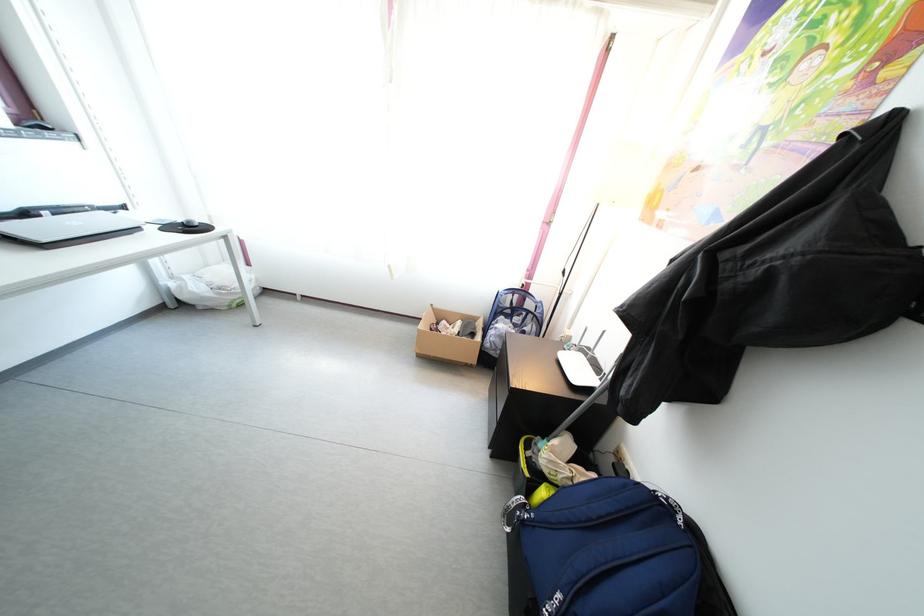
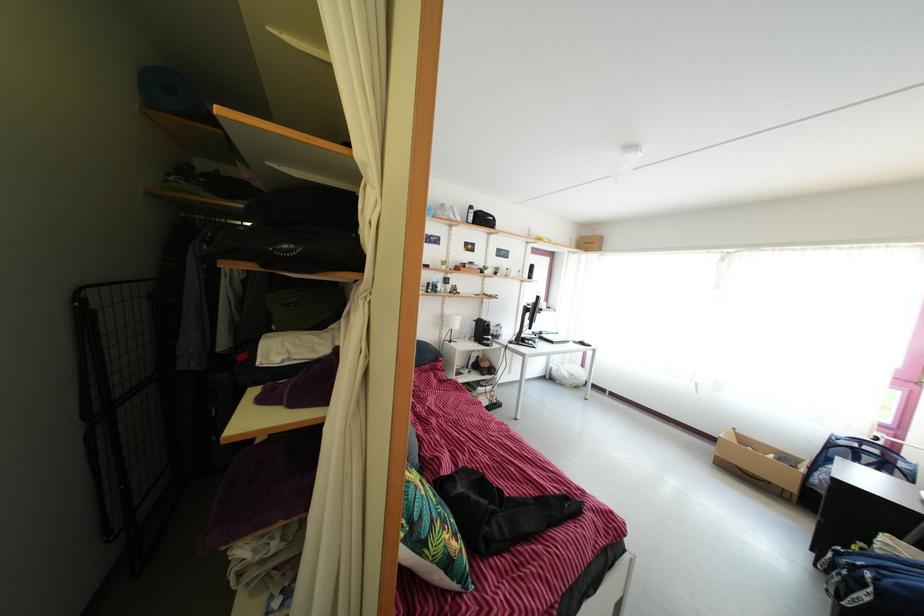
Locate, in the second image, the point that corresponds to point (482, 328) in the first image.

(805, 468)